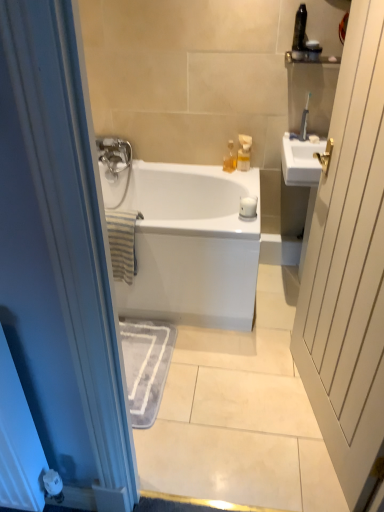
Where is `vacant space situated on the left part of white wood door at right`? The height and width of the screenshot is (512, 384). vacant space situated on the left part of white wood door at right is located at coordinates (238, 410).